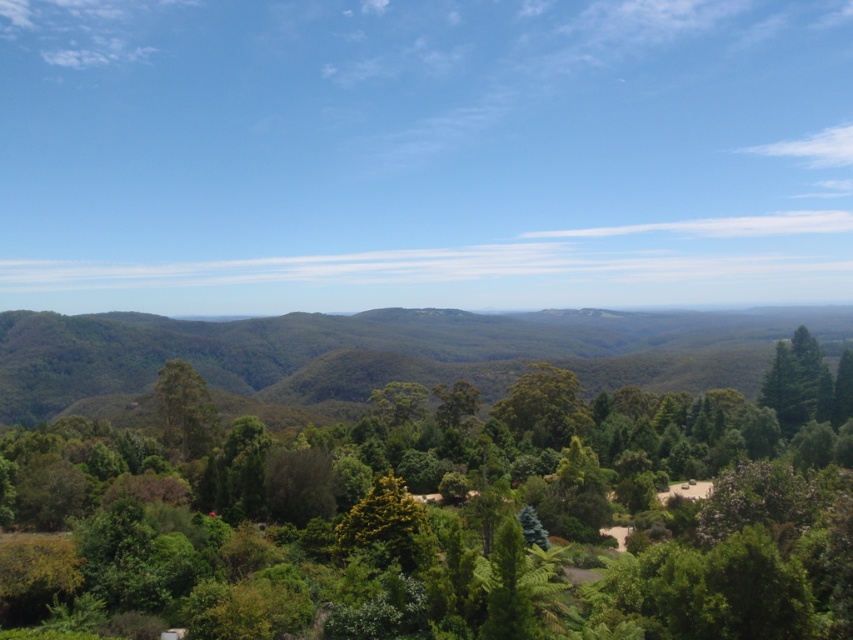
Question: Is green leafy tree at center to the right of green leafy forest at left from the viewer's perspective?

Choices:
 (A) no
 (B) yes

Answer: (A)

Question: Which object is farther from the camera taking this photo?

Choices:
 (A) green leafy forest at left
 (B) green leafy tree at center
 (C) green leafy tree at left

Answer: (A)

Question: From the image, what is the correct spatial relationship of green leafy tree at center in relation to green leafy tree at left?

Choices:
 (A) right
 (B) left

Answer: (A)

Question: Which of the following is the farthest from the observer?

Choices:
 (A) (738, 616)
 (B) (349, 362)

Answer: (B)

Question: Is green leafy forest at left to the right of green leafy tree at left from the viewer's perspective?

Choices:
 (A) no
 (B) yes

Answer: (B)

Question: Which is nearer to the green leafy forest at left?

Choices:
 (A) green leafy tree at left
 (B) green leafy tree at center

Answer: (B)